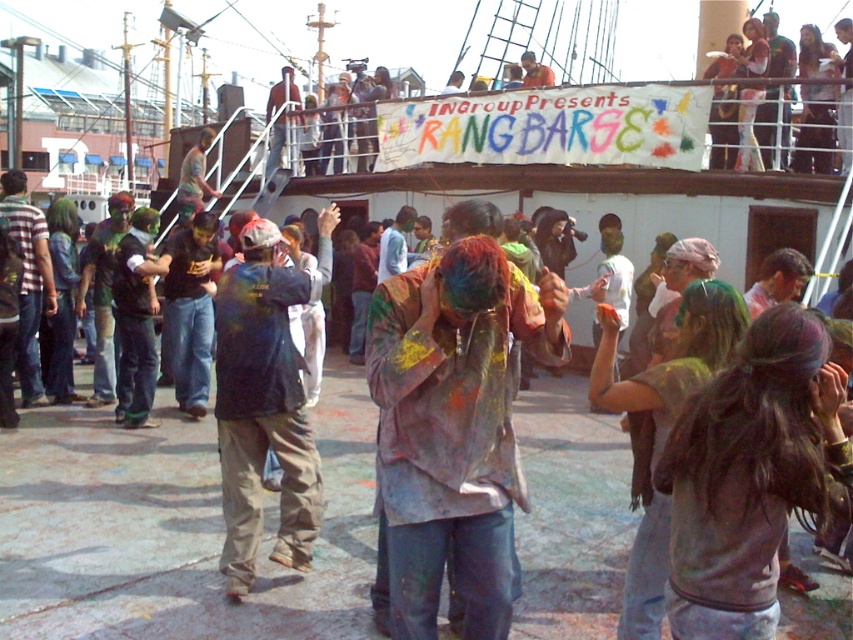
Question: Which object is positioned farthest from the striped shirt at left?

Choices:
 (A) matte black shirt at center
 (B) brown leather jacket at upper center
 (C) dark blue jeans at center
 (D) multicolored paint-covered shirt at center

Answer: (A)

Question: Which of the following is the closest to the observer?

Choices:
 (A) matte black shirt at upper right
 (B) striped shirt at left
 (C) multicolored paint-covered shirt at center

Answer: (B)

Question: Which of the following is the closest to the observer?

Choices:
 (A) dark blue jeans at center
 (B) matte black shirt at center
 (C) striped shirt at left
 (D) matte black shirt at upper right

Answer: (A)

Question: Can you confirm if striped shirt at left is positioned below brown leather jacket at upper center?

Choices:
 (A) no
 (B) yes

Answer: (B)

Question: Is striped shirt at left positioned behind multicolored paint-covered shirt at center?

Choices:
 (A) no
 (B) yes

Answer: (A)

Question: In this image, where is dark blue jeans at center located relative to matte black shirt at upper right?

Choices:
 (A) right
 (B) left

Answer: (B)